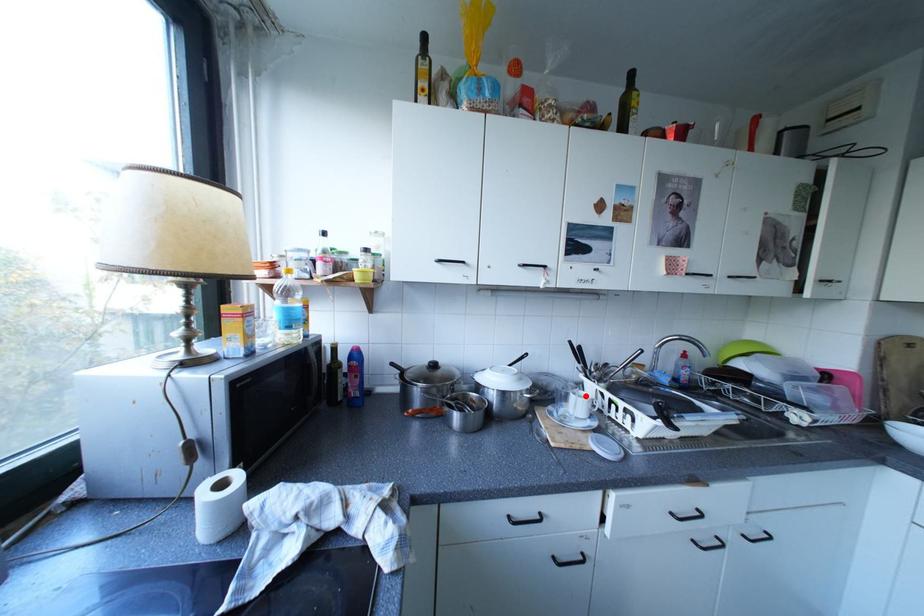
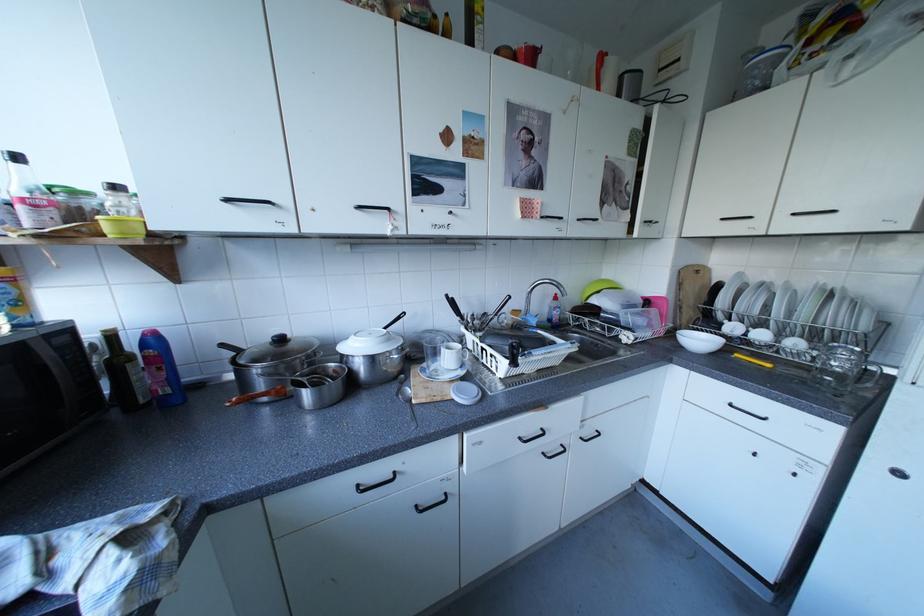
Where in the second image is the point corresponding to the highlighted location from the first image?

(456, 349)